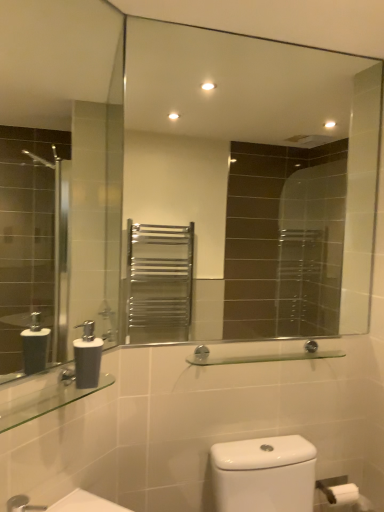
Question: Looking at their shapes, would you say matte gray soap dispenser at lower left is wider or thinner than clear glass shelf at lower left, the 1th balustrade in the left-to-right sequence?

Choices:
 (A) wide
 (B) thin

Answer: (B)

Question: Is matte gray soap dispenser at lower left in front of or behind clear glass shelf at lower left, arranged as the 1th balustrade when viewed from the front, in the image?

Choices:
 (A) front
 (B) behind

Answer: (B)

Question: Estimate the real-world distances between objects in this image. Which object is farther from the clear glass shelf at lower left, marked as the 2th balustrade in a back-to-front arrangement?

Choices:
 (A) clear glass shelf at center, placed as the second balustrade when sorted from left to right
 (B) matte gray soap dispenser at lower left

Answer: (A)

Question: Which object is positioned closest to the matte gray soap dispenser at lower left?

Choices:
 (A) clear glass shelf at center, placed as the second balustrade when sorted from left to right
 (B) clear glass shelf at lower left, marked as the 2th balustrade in a back-to-front arrangement

Answer: (B)